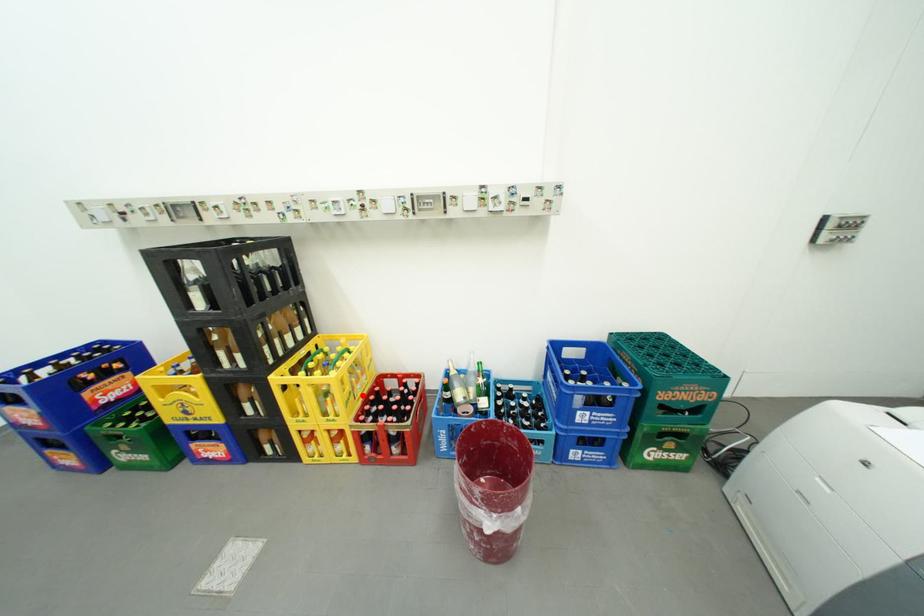
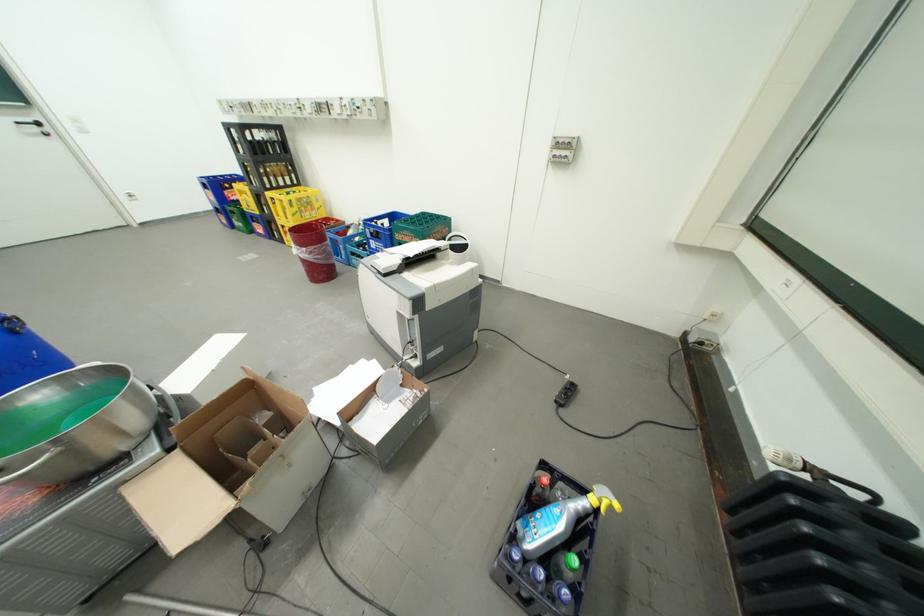
In the second image, find the point that corresponds to the highlighted location in the first image.

(310, 215)